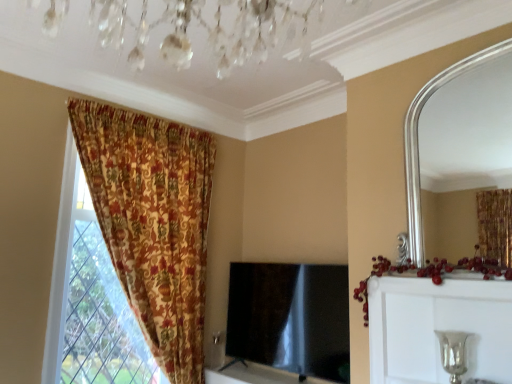
Measure the distance between black glossy tv at center and camera.

black glossy tv at center is 7.51 feet away from camera.

What are the coordinates of `silver/metallic mirror at upper right` in the screenshot? It's located at (468, 130).

At what (x,y) coordinates should I click in order to perform the action: click on silver metallic vase at upper right. Please return your answer as a coordinate pair (x, y). This screenshot has height=384, width=512. Looking at the image, I should click on (438, 328).

What do you see at coordinates (438, 328) in the screenshot?
I see `silver metallic vase at upper right` at bounding box center [438, 328].

At what (x,y) coordinates should I click in order to perform the action: click on black glossy tv at center. Please return your answer as a coordinate pair (x, y). The height and width of the screenshot is (384, 512). Looking at the image, I should click on (290, 318).

Is point (157, 123) behind point (454, 340)?

That is True.

Are floral fabric curtain at left and silver metallic candle holder at lower right making contact?

floral fabric curtain at left and silver metallic candle holder at lower right are not in contact.

In the image, there is a silver metallic candle holder at lower right. Where is `curtain above it (from the image's perspective)`? Image resolution: width=512 pixels, height=384 pixels. curtain above it (from the image's perspective) is located at coordinates [153, 222].

Considering the positions of objects floral fabric curtain at left and silver metallic candle holder at lower right in the image provided, who is more to the left, floral fabric curtain at left or silver metallic candle holder at lower right?

Positioned to the left is floral fabric curtain at left.

Considering the relative positions of silver metallic vase at upper right and silver metallic candle holder at lower right in the image provided, is silver metallic vase at upper right to the left of silver metallic candle holder at lower right from the viewer's perspective?

Yes, silver metallic vase at upper right is to the left of silver metallic candle holder at lower right.

Which is in front, point (426, 305) or point (461, 334)?

Positioned in front is point (461, 334).

Is silver metallic vase at upper right not within silver metallic candle holder at lower right?

Yes, silver metallic vase at upper right is located beyond the bounds of silver metallic candle holder at lower right.

From the image's perspective, is silver metallic vase at upper right under silver metallic candle holder at lower right?

Incorrect, from the image's perspective, silver metallic vase at upper right is higher than silver metallic candle holder at lower right.

Is point (496, 141) positioned behind point (426, 353)?

Yes, point (496, 141) is farther from viewer.

Are silver/metallic mirror at upper right and silver metallic vase at upper right located far from each other?

silver/metallic mirror at upper right is far away from silver metallic vase at upper right.

Consider the image. From the image's perspective, who appears lower, silver/metallic mirror at upper right or silver metallic vase at upper right?

silver metallic vase at upper right.

Considering the positions of objects silver/metallic mirror at upper right and silver metallic vase at upper right in the image provided, who is more to the left, silver/metallic mirror at upper right or silver metallic vase at upper right?

silver metallic vase at upper right.

Is silver metallic candle holder at lower right facing away from black glossy tv at center?

No, silver metallic candle holder at lower right is not facing away from black glossy tv at center.

Based on their sizes in the image, would you say silver metallic candle holder at lower right is bigger or smaller than black glossy tv at center?

In the image, silver metallic candle holder at lower right appears to be smaller than black glossy tv at center.

Which of these two, silver metallic candle holder at lower right or black glossy tv at center, stands taller?

black glossy tv at center.

Between floral fabric curtain at left and silver metallic vase at upper right, which one has smaller width?

With smaller width is silver metallic vase at upper right.

From the picture: Is floral fabric curtain at left turned away from silver metallic vase at upper right?

floral fabric curtain at left is not turned away from silver metallic vase at upper right.

Which object is more forward, floral fabric curtain at left or silver metallic vase at upper right?

silver metallic vase at upper right.

In the scene shown: In the image, is silver/metallic mirror at upper right positioned in front of or behind floral fabric curtain at left?

silver/metallic mirror at upper right is positioned closer to the viewer than floral fabric curtain at left.

Considering the relative sizes of silver/metallic mirror at upper right and floral fabric curtain at left in the image provided, is silver/metallic mirror at upper right wider than floral fabric curtain at left?

No, silver/metallic mirror at upper right is not wider than floral fabric curtain at left.

Based on the photo, who is taller, silver/metallic mirror at upper right or floral fabric curtain at left?

With more height is floral fabric curtain at left.

Does silver/metallic mirror at upper right turn towards floral fabric curtain at left?

No, silver/metallic mirror at upper right is not turned towards floral fabric curtain at left.

You are a GUI agent. You are given a task and a screenshot of the screen. Output one action in this format:
    pyautogui.click(x=<x>, y=<y>)
    Task: Click on the curtain that is on the left side of silver metallic candle holder at lower right
    
    Given the screenshot: What is the action you would take?
    pyautogui.click(x=153, y=222)

Which is closer to the camera, (449, 357) or (153, 132)?

Point (449, 357) appears to be closer to the viewer than point (153, 132).

Considering the sizes of objects silver metallic candle holder at lower right and floral fabric curtain at left in the image provided, who is thinner, silver metallic candle holder at lower right or floral fabric curtain at left?

Thinner between the two is silver metallic candle holder at lower right.

This screenshot has height=384, width=512. What are the coordinates of `candle holder that is under the floral fabric curtain at left (from a real-world perspective)` in the screenshot? It's located at (453, 353).

Where is `dresser that appears on the left of silver metallic candle holder at lower right`? dresser that appears on the left of silver metallic candle holder at lower right is located at coordinates (438, 328).

Based on their spatial positions, is floral fabric curtain at left or black glossy tv at center further from silver metallic candle holder at lower right?

floral fabric curtain at left lies further to silver metallic candle holder at lower right than the other object.

Looking at the image, which one is located closer to silver metallic vase at upper right, silver/metallic mirror at upper right or silver metallic candle holder at lower right?

silver metallic candle holder at lower right is closer to silver metallic vase at upper right.

Considering their positions, is silver metallic candle holder at lower right positioned closer to silver/metallic mirror at upper right than silver metallic vase at upper right?

The object closer to silver/metallic mirror at upper right is silver metallic vase at upper right.

Based on their spatial positions, is silver/metallic mirror at upper right or silver metallic candle holder at lower right further from floral fabric curtain at left?

silver/metallic mirror at upper right is positioned further to the anchor floral fabric curtain at left.

Considering their positions, is silver metallic candle holder at lower right positioned closer to silver metallic vase at upper right than black glossy tv at center?

The object closer to silver metallic vase at upper right is silver metallic candle holder at lower right.

From the image, which object appears to be farther from silver metallic candle holder at lower right, floral fabric curtain at left or silver metallic vase at upper right?

floral fabric curtain at left.

Which object lies nearer to the anchor point silver metallic vase at upper right, floral fabric curtain at left or silver metallic candle holder at lower right?

silver metallic candle holder at lower right lies closer to silver metallic vase at upper right than the other object.

Which object lies further to the anchor point silver metallic candle holder at lower right, silver metallic vase at upper right or black glossy tv at center?

black glossy tv at center lies further to silver metallic candle holder at lower right than the other object.

Find the location of a particular element. Image resolution: width=512 pixels, height=384 pixels. dresser that lies between silver/metallic mirror at upper right and black glossy tv at center from top to bottom is located at coordinates (438, 328).

This screenshot has height=384, width=512. What are the coordinates of `candle holder positioned between silver metallic vase at upper right and black glossy tv at center from near to far` in the screenshot? It's located at (453, 353).

The height and width of the screenshot is (384, 512). Find the location of `candle holder that lies between silver/metallic mirror at upper right and black glossy tv at center from top to bottom`. candle holder that lies between silver/metallic mirror at upper right and black glossy tv at center from top to bottom is located at coordinates (453, 353).

At what (x,y) coordinates should I click in order to perform the action: click on dresser between floral fabric curtain at left and silver metallic candle holder at lower right from left to right. Please return your answer as a coordinate pair (x, y). Image resolution: width=512 pixels, height=384 pixels. Looking at the image, I should click on (438, 328).